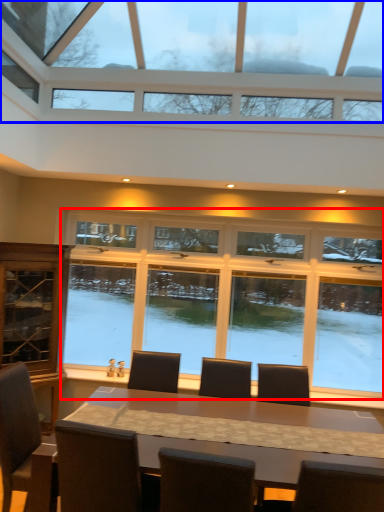
Question: Which of the following is the closest to the observer, window (highlighted by a red box) or window (highlighted by a blue box)?

Choices:
 (A) window
 (B) window

Answer: (B)